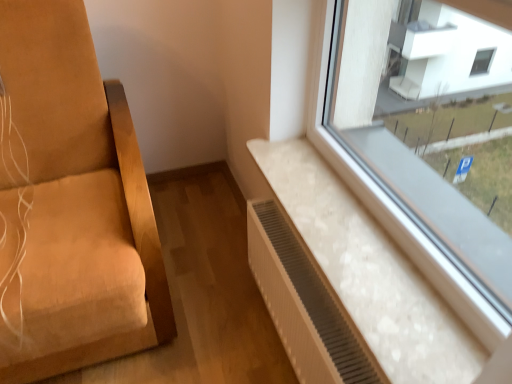
The width and height of the screenshot is (512, 384). What are the coordinates of `white textured radiator at lower right` in the screenshot? It's located at (303, 304).

Describe the element at coordinates (303, 304) in the screenshot. The width and height of the screenshot is (512, 384). I see `white textured radiator at lower right` at that location.

Describe the element at coordinates (370, 271) in the screenshot. I see `white marble radiator at lower right` at that location.

Locate an element on the screen. The width and height of the screenshot is (512, 384). white marble radiator at lower right is located at coordinates (370, 271).

You are a GUI agent. You are given a task and a screenshot of the screen. Output one action in this format:
    pyautogui.click(x=<x>, y=<y>)
    Task: Click on the white textured radiator at lower right
    This screenshot has height=384, width=512.
    Given the screenshot: What is the action you would take?
    pyautogui.click(x=303, y=304)

Which object is positioned more to the right, white textured radiator at lower right or white marble radiator at lower right?

From the viewer's perspective, white marble radiator at lower right appears more on the right side.

Is white textured radiator at lower right behind white marble radiator at lower right?

Yes, the depth of white textured radiator at lower right is greater than that of white marble radiator at lower right.

Does point (286, 247) appear closer or farther from the camera than point (305, 157)?

Point (286, 247).

From the image's perspective, which is above, white textured radiator at lower right or white marble radiator at lower right?

white marble radiator at lower right appears higher in the image.

From a real-world perspective, is white textured radiator at lower right located higher than white marble radiator at lower right?

No.

Considering the sizes of white textured radiator at lower right and white marble radiator at lower right in the image, is white textured radiator at lower right wider or thinner than white marble radiator at lower right?

white textured radiator at lower right is thinner than white marble radiator at lower right.

From their relative heights in the image, would you say white textured radiator at lower right is taller or shorter than white marble radiator at lower right?

Considering their sizes, white textured radiator at lower right has more height than white marble radiator at lower right.

Between white textured radiator at lower right and white marble radiator at lower right, which one has larger size?

With larger size is white textured radiator at lower right.

Which is correct: white textured radiator at lower right is inside white marble radiator at lower right, or outside of it?

white textured radiator at lower right lies outside white marble radiator at lower right.

Is the surface of white textured radiator at lower right in direct contact with white marble radiator at lower right?

No, white textured radiator at lower right is not in contact with white marble radiator at lower right.

Could you tell me if white textured radiator at lower right is turned towards white marble radiator at lower right?

No, white textured radiator at lower right is not aimed at white marble radiator at lower right.

How many degrees apart are the facing directions of white textured radiator at lower right and white marble radiator at lower right?

0.461 degrees.

How distant is white textured radiator at lower right from white marble radiator at lower right?

A distance of 7.06 inches exists between white textured radiator at lower right and white marble radiator at lower right.

Identify the location of air conditioner below the white marble radiator at lower right (from a real-world perspective). The width and height of the screenshot is (512, 384). (303, 304).

Which object is positioned more to the left, white marble radiator at lower right or white textured radiator at lower right?

Positioned to the left is white textured radiator at lower right.

Is white marble radiator at lower right in front of or behind white textured radiator at lower right in the image?

white marble radiator at lower right is in front of white textured radiator at lower right.

Is point (325, 216) closer or farther from the camera than point (275, 202)?

Clearly, point (325, 216) is closer to the camera than point (275, 202).

From the image's perspective, does white marble radiator at lower right appear lower than white textured radiator at lower right?

Incorrect, from the image's perspective, white marble radiator at lower right is higher than white textured radiator at lower right.

From a real-world perspective, is white marble radiator at lower right physically above white textured radiator at lower right?

Correct, in the physical world, white marble radiator at lower right is higher than white textured radiator at lower right.

Can you confirm if white marble radiator at lower right is wider than white textured radiator at lower right?

Correct, the width of white marble radiator at lower right exceeds that of white textured radiator at lower right.

Does white marble radiator at lower right have a lesser height compared to white textured radiator at lower right?

Yes, white marble radiator at lower right is shorter than white textured radiator at lower right.

Which of these two, white marble radiator at lower right or white textured radiator at lower right, is smaller?

white marble radiator at lower right.

Which is correct: white marble radiator at lower right is inside white textured radiator at lower right, or outside of it?

white marble radiator at lower right exists outside the volume of white textured radiator at lower right.

Is white marble radiator at lower right next to white textured radiator at lower right and touching it?

white marble radiator at lower right is not next to white textured radiator at lower right, and they're not touching.

Is white marble radiator at lower right positioned with its back to white textured radiator at lower right?

That's not correct — white marble radiator at lower right is not looking away from white textured radiator at lower right.

Based on the photo, how many degrees apart are the facing directions of white marble radiator at lower right and white textured radiator at lower right?

0.461 degrees separate the facing orientations of white marble radiator at lower right and white textured radiator at lower right.

How much distance is there between white marble radiator at lower right and white textured radiator at lower right?

white marble radiator at lower right is 7.06 inches from white textured radiator at lower right.

You are a GUI agent. You are given a task and a screenshot of the screen. Output one action in this format:
    pyautogui.click(x=<x>, y=<y>)
    Task: Click on the window sill that is on the right side of white textured radiator at lower right
    
    Given the screenshot: What is the action you would take?
    pyautogui.click(x=370, y=271)

The height and width of the screenshot is (384, 512). Find the location of `air conditioner behind the white marble radiator at lower right`. air conditioner behind the white marble radiator at lower right is located at coordinates (303, 304).

The height and width of the screenshot is (384, 512). There is a white textured radiator at lower right. What are the coordinates of `window sill above it (from a real-world perspective)` in the screenshot? It's located at (370, 271).